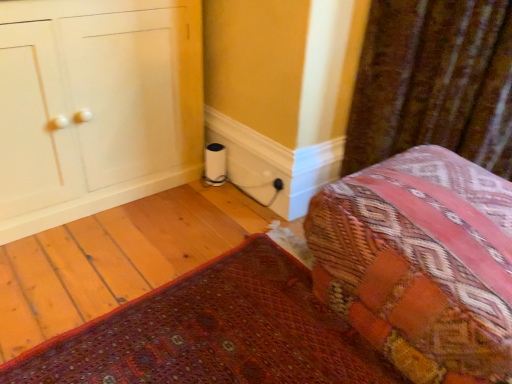
Question: In terms of width, does white glossy cabinet at left, which is counted as the 1th furniture, starting from the top, look wider or thinner when compared to textured woven bed at lower right?

Choices:
 (A) wide
 (B) thin

Answer: (B)

Question: Looking at the image, does white glossy cabinet at left, the second furniture ordered from the bottom, seem bigger or smaller compared to textured woven bed at lower right?

Choices:
 (A) small
 (B) big

Answer: (B)

Question: Based on their relative distances, which object is nearer to the black plastic electric outlet at lower right?

Choices:
 (A) patterned fabric cushion at lower right, which ranks as the 1th furniture in bottom-to-top order
 (B) textured woven bed at lower right
 (C) velvet brown curtain at upper right
 (D) white glossy cabinet at left, the second furniture ordered from the bottom

Answer: (C)

Question: Which is farther from the textured woven bed at lower right?

Choices:
 (A) white glossy cabinet at left, which is counted as the 1th furniture, starting from the top
 (B) patterned fabric cushion at lower right, which ranks as the 1th furniture in bottom-to-top order
 (C) black plastic electric outlet at lower right
 (D) velvet brown curtain at upper right

Answer: (A)